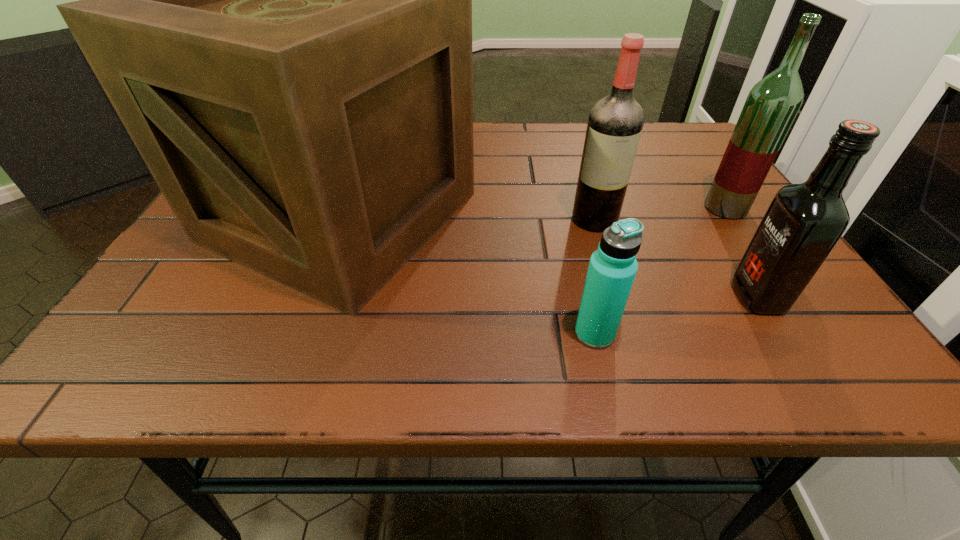
Locate an element on the screen. The height and width of the screenshot is (540, 960). free point at the near right corner is located at coordinates (749, 337).

Identify the location of vacant region between the leftmost liquor and the nearest liquor. The width and height of the screenshot is (960, 540). (676, 258).

The height and width of the screenshot is (540, 960). In order to click on unoccupied area between the leftmost liquor and the box in this screenshot , I will do `click(468, 218)`.

Image resolution: width=960 pixels, height=540 pixels. Find the location of `vacant point located between the box and the nearest object`. vacant point located between the box and the nearest object is located at coordinates (468, 275).

Locate an element on the screen. unoccupied area between the nearest liquor and the leftmost liquor is located at coordinates (676, 258).

Where is `unoccupied position between the box and the water bottle`? The height and width of the screenshot is (540, 960). unoccupied position between the box and the water bottle is located at coordinates (468, 275).

Identify the location of vacant area that lies between the leftmost object and the leftmost liquor. The height and width of the screenshot is (540, 960). (468, 218).

You are a GUI agent. You are given a task and a screenshot of the screen. Output one action in this format:
    pyautogui.click(x=<x>, y=<y>)
    Task: Click on the blank region between the water bottle and the box
    
    Given the screenshot: What is the action you would take?
    pyautogui.click(x=468, y=275)

Locate which object is the third closest to the box. Please provide its 2D coordinates. Your answer should be formatted as a tuple, i.e. [(x, y)], where the tuple contains the x and y coordinates of a point satisfying the conditions above.

[(803, 223)]

Locate an element on the screen. The image size is (960, 540). object that is the closest to the leftmost liquor is located at coordinates (772, 105).